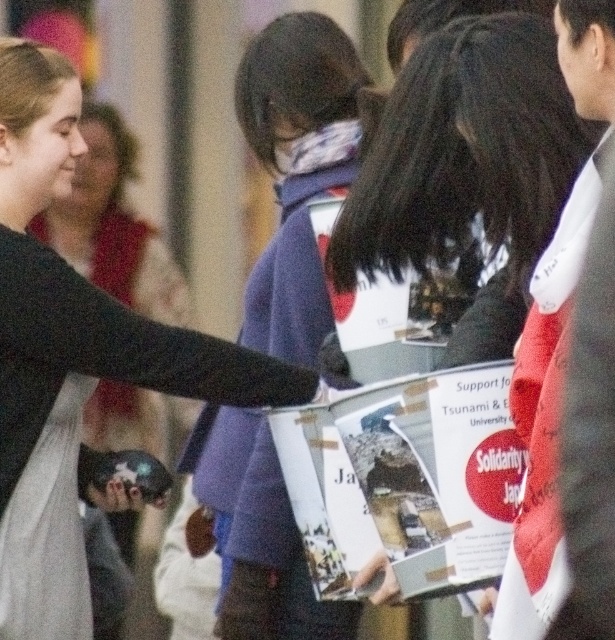
You are standing in the crowd at the event and want to see which jacket is higher. Which one is positioned higher between the matte black jacket at center and the purple fleece jacket at center?

The purple fleece jacket at center is positioned higher than the matte black jacket at center because the matte black jacket at center is below it.

You are organizing a charity event and need to ensure that the collection box is easily visible. The matte black sweater at left and the matte black hand at center are blocking the view of the collection box. Which object should you move to improve visibility, considering their widths?

The matte black sweater at left is wider than the matte black hand at center, so moving the matte black sweater at left would be more effective in improving visibility since it has a greater width and is blocking more of the view.